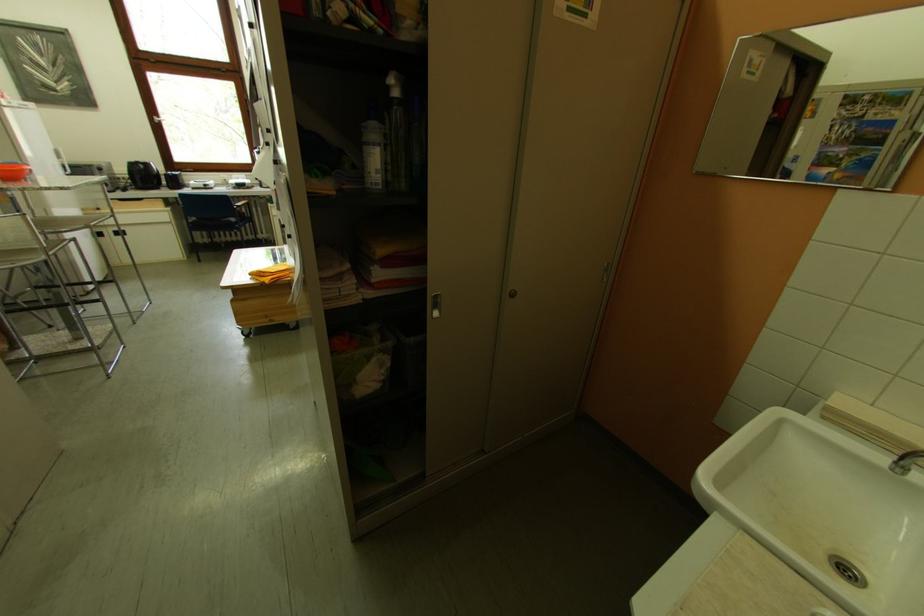
Where would you turn the white window handle? Please return your answer as a coordinate pair (x, y).

(156, 119)